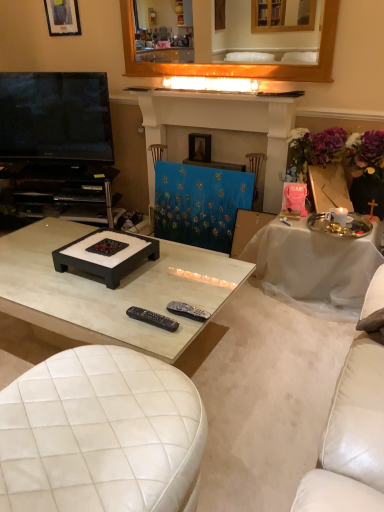
Question: Considering the positions of point (203, 62) and point (97, 322), is point (203, 62) closer or farther from the camera than point (97, 322)?

Choices:
 (A) closer
 (B) farther

Answer: (B)

Question: Relative to white glossy coffee table at center, is wooden mirror at upper center in front or behind?

Choices:
 (A) front
 (B) behind

Answer: (B)

Question: Estimate the real-world distances between objects in this image. Which object is closer to the white marble fireplace at upper center?

Choices:
 (A) black plastic remote at center, the second remote control from the left
 (B) black plastic entertainment center at left
 (C) matte black picture frame at upper left, which is counted as the second picture frame, starting from the bottom
 (D) flat screen tv at left
 (E) black plastic remote control at center, which ranks as the second remote control in right-to-left order

Answer: (D)

Question: Estimate the real-world distances between objects in this image. Which object is farther from the white leather ottoman at lower left?

Choices:
 (A) white glossy coffee table at center
 (B) black plastic remote at center, the second remote control from the left
 (C) black plastic entertainment center at left
 (D) blue fabric painting at center
 (E) flat screen tv at left

Answer: (E)